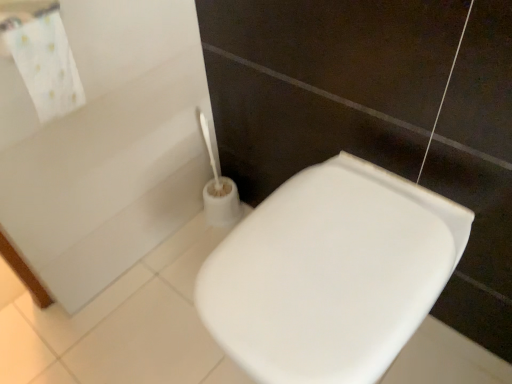
Question: Based on their sizes in the image, would you say white fabric towel at upper left is bigger or smaller than white glossy toilet seat at lower right?

Choices:
 (A) big
 (B) small

Answer: (B)

Question: Considering their positions, is white fabric towel at upper left located in front of or behind white glossy toilet seat at lower right?

Choices:
 (A) front
 (B) behind

Answer: (B)

Question: Considering the positions of white fabric towel at upper left and white glossy toilet seat at lower right in the image, is white fabric towel at upper left wider or thinner than white glossy toilet seat at lower right?

Choices:
 (A) thin
 (B) wide

Answer: (A)

Question: Is white glossy toilet seat at lower right taller or shorter than white fabric towel at upper left?

Choices:
 (A) short
 (B) tall

Answer: (B)

Question: Is white glossy toilet seat at lower right bigger or smaller than white fabric towel at upper left?

Choices:
 (A) big
 (B) small

Answer: (A)

Question: From the image's perspective, relative to white fabric towel at upper left, is white glossy toilet seat at lower right above or below?

Choices:
 (A) below
 (B) above

Answer: (A)

Question: Would you say white glossy toilet seat at lower right is inside or outside white fabric towel at upper left?

Choices:
 (A) inside
 (B) outside

Answer: (B)